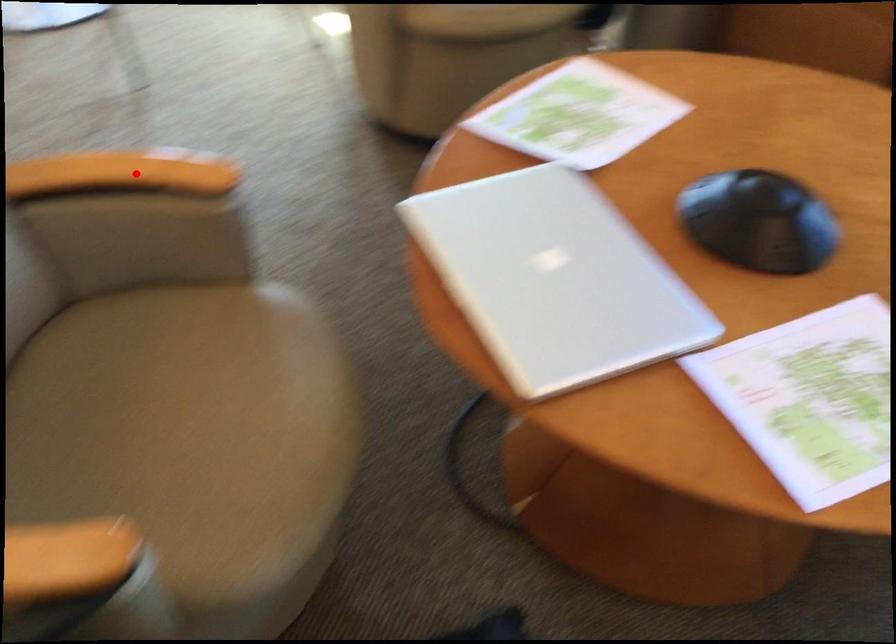
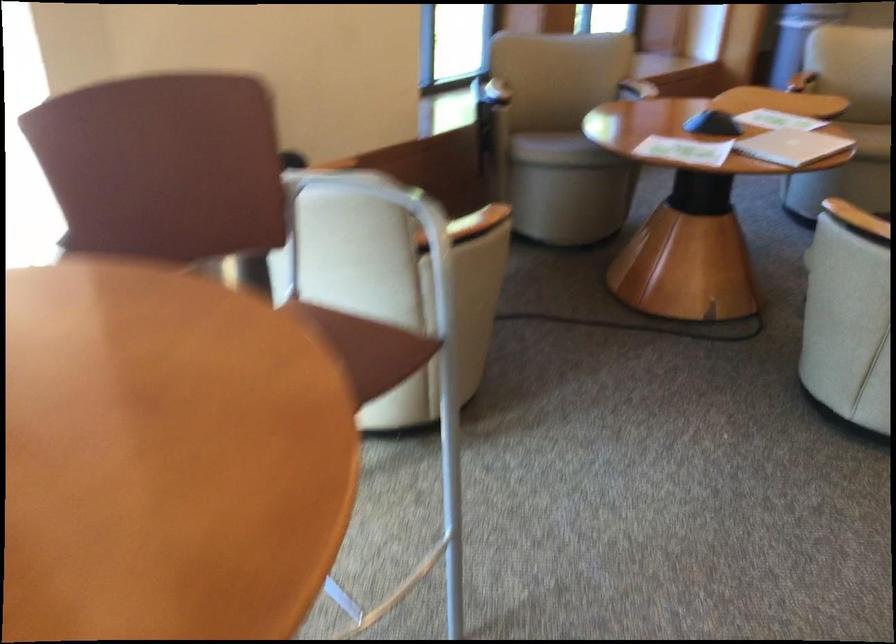
Find the pixel in the second image that matches the highlighted location in the first image.

(857, 220)